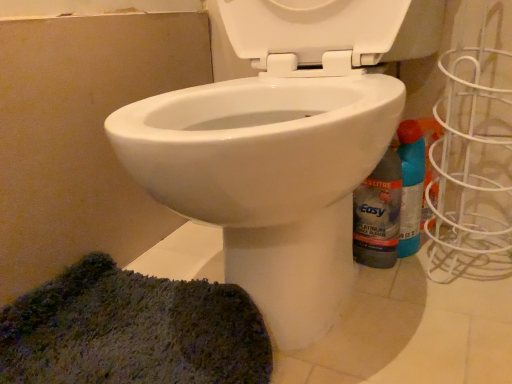
Question: Looking at their shapes, would you say green textured rug at lower left is wider or thinner than blue plastic spray bottle at right?

Choices:
 (A) wide
 (B) thin

Answer: (A)

Question: Based on their positions, is green textured rug at lower left located to the left or right of blue plastic spray bottle at right?

Choices:
 (A) left
 (B) right

Answer: (A)

Question: Estimate the real-world distances between objects in this image. Which object is closer to the blue plastic spray bottle at right?

Choices:
 (A) green textured rug at lower left
 (B) translucent plastic bottle at lower right

Answer: (B)

Question: Which object is positioned farthest from the blue plastic spray bottle at right?

Choices:
 (A) green textured rug at lower left
 (B) translucent plastic bottle at lower right

Answer: (A)